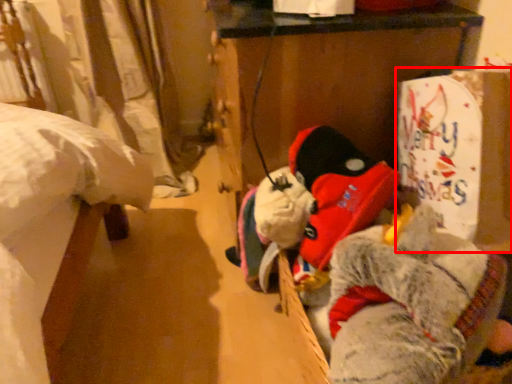
Question: From the image's perspective, what is the correct spatial relationship of cardboard box (annotated by the red box) in relation to animal?

Choices:
 (A) below
 (B) above

Answer: (B)